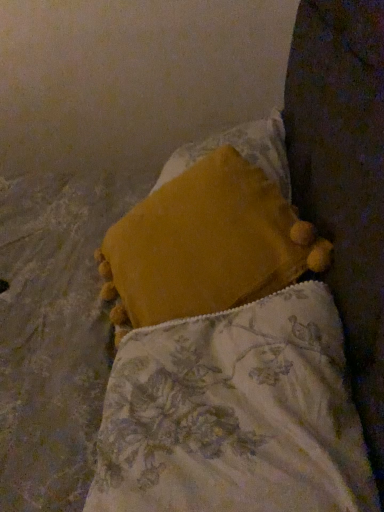
Question: Which direction should I rotate to face velvety yellow pillow at center, which is counted as the 1th pillow, starting from the back, — up or down?

Choices:
 (A) up
 (B) down

Answer: (A)

Question: From the image's perspective, would you say velvety yellow pillow at center, which is counted as the 1th pillow, starting from the back, is shown under velvet yellow pillow at center, which is the second pillow in back-to-front order?

Choices:
 (A) yes
 (B) no

Answer: (B)

Question: Is velvety yellow pillow at center, which is counted as the 1th pillow, starting from the back, oriented towards velvet yellow pillow at center, marked as the 1th pillow in a front-to-back arrangement?

Choices:
 (A) yes
 (B) no

Answer: (B)

Question: Is velvety yellow pillow at center, placed as the second pillow when sorted from front to back, at the right side of velvet yellow pillow at center, marked as the 1th pillow in a front-to-back arrangement?

Choices:
 (A) yes
 (B) no

Answer: (A)

Question: Is velvety yellow pillow at center, which is counted as the 1th pillow, starting from the back, beside velvet yellow pillow at center, marked as the 1th pillow in a front-to-back arrangement?

Choices:
 (A) no
 (B) yes

Answer: (A)

Question: Is velvet yellow pillow at center, marked as the 1th pillow in a front-to-back arrangement, inside velvety yellow pillow at center, which is counted as the 1th pillow, starting from the back?

Choices:
 (A) yes
 (B) no

Answer: (B)

Question: Is velvety yellow pillow at center, placed as the second pillow when sorted from front to back, located outside velvet yellow pillow at center, which is the second pillow in back-to-front order?

Choices:
 (A) no
 (B) yes

Answer: (B)

Question: Does velvet yellow pillow at center, marked as the 1th pillow in a front-to-back arrangement, have a lesser height compared to velvety yellow pillow at center, which is counted as the 1th pillow, starting from the back?

Choices:
 (A) yes
 (B) no

Answer: (B)

Question: Does velvet yellow pillow at center, marked as the 1th pillow in a front-to-back arrangement, have a greater height compared to velvety yellow pillow at center, placed as the second pillow when sorted from front to back?

Choices:
 (A) yes
 (B) no

Answer: (A)

Question: Is velvet yellow pillow at center, which is the second pillow in back-to-front order, looking in the opposite direction of velvety yellow pillow at center, which is counted as the 1th pillow, starting from the back?

Choices:
 (A) no
 (B) yes

Answer: (A)

Question: Does velvet yellow pillow at center, marked as the 1th pillow in a front-to-back arrangement, turn towards velvety yellow pillow at center, which is counted as the 1th pillow, starting from the back?

Choices:
 (A) yes
 (B) no

Answer: (B)

Question: Considering the relative positions of velvet yellow pillow at center, marked as the 1th pillow in a front-to-back arrangement, and velvety yellow pillow at center, which is counted as the 1th pillow, starting from the back, in the image provided, is velvet yellow pillow at center, marked as the 1th pillow in a front-to-back arrangement, to the right of velvety yellow pillow at center, which is counted as the 1th pillow, starting from the back, from the viewer's perspective?

Choices:
 (A) yes
 (B) no

Answer: (B)

Question: Considering the relative sizes of velvet yellow pillow at center, marked as the 1th pillow in a front-to-back arrangement, and velvety yellow pillow at center, which is counted as the 1th pillow, starting from the back, in the image provided, is velvet yellow pillow at center, marked as the 1th pillow in a front-to-back arrangement, bigger than velvety yellow pillow at center, which is counted as the 1th pillow, starting from the back,?

Choices:
 (A) no
 (B) yes

Answer: (A)

Question: Based on their positions, is velvet yellow pillow at center, marked as the 1th pillow in a front-to-back arrangement, located to the left or right of velvety yellow pillow at center, placed as the second pillow when sorted from front to back?

Choices:
 (A) right
 (B) left

Answer: (B)